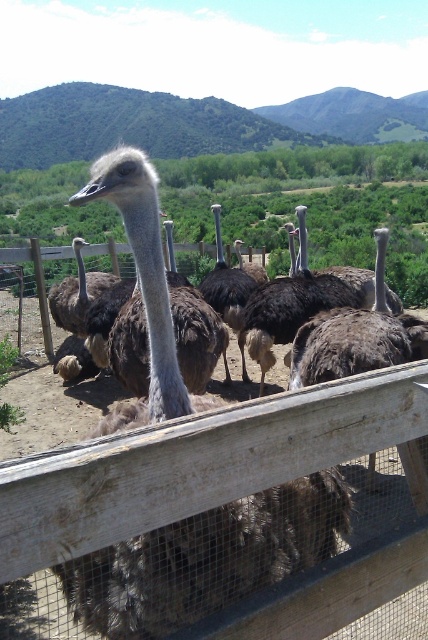
Question: Observing the image, what is the correct spatial positioning of wooden fence at center in reference to dark brown feathers at center?

Choices:
 (A) below
 (B) above

Answer: (A)

Question: Is wooden fence at center bigger than dark brown feathers at center?

Choices:
 (A) yes
 (B) no

Answer: (A)

Question: Which of the following is the closest to the observer?

Choices:
 (A) wooden fence at center
 (B) dark brown feathers at center

Answer: (A)

Question: Among these objects, which one is nearest to the camera?

Choices:
 (A) wooden fence at center
 (B) dark brown feathers at center

Answer: (A)

Question: Is wooden fence at center positioned behind dark brown feathers at center?

Choices:
 (A) yes
 (B) no

Answer: (B)

Question: Which point is farther from the camera taking this photo?

Choices:
 (A) pos(312,460)
 (B) pos(229,308)

Answer: (B)